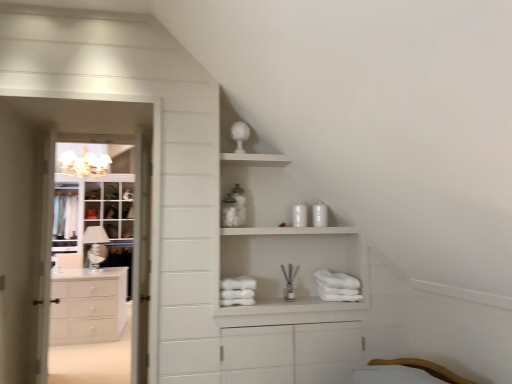
What do you see at coordinates (283, 242) in the screenshot? Image resolution: width=512 pixels, height=384 pixels. I see `white matte cabinet at upper center` at bounding box center [283, 242].

At what (x,y) coordinates should I click in order to perform the action: click on white wood door at left. Please return your answer as a coordinate pair (x, y). This screenshot has width=512, height=384. Looking at the image, I should click on (140, 258).

You are a GUI agent. You are given a task and a screenshot of the screen. Output one action in this format:
    pyautogui.click(x=<x>, y=<y>)
    Task: Click on the white glossy cabinet at left
    
    Given the screenshot: What is the action you would take?
    pyautogui.click(x=103, y=248)

What do you see at coordinates (103, 248) in the screenshot? I see `white glossy cabinet at left` at bounding box center [103, 248].

What do you see at coordinates (93, 211) in the screenshot? Image resolution: width=512 pixels, height=384 pixels. I see `white glass cabinet at left` at bounding box center [93, 211].

This screenshot has height=384, width=512. Describe the element at coordinates (88, 305) in the screenshot. I see `white matte chest of drawers at left` at that location.

Find the location of `white matte cabinet at upper center`. white matte cabinet at upper center is located at coordinates (283, 242).

From the image's perspective, is clear glass lamp at left located beneath white glossy cabinet at left?

Yes, from the image's perspective, clear glass lamp at left is beneath white glossy cabinet at left.

From the picture: Can white glossy cabinet at left be found inside clear glass lamp at left?

No, white glossy cabinet at left is located outside of clear glass lamp at left.

Is clear glass lamp at left closer to camera compared to white glossy cabinet at left?

No, clear glass lamp at left is further to the viewer.

Does clear glass lamp at left have a larger size compared to white glossy cabinet at left?

Actually, clear glass lamp at left might be smaller than white glossy cabinet at left.

Considering the positions of objects white glossy cabinet at left and white matte cabinet at upper center in the image provided, who is behind, white glossy cabinet at left or white matte cabinet at upper center?

Positioned behind is white glossy cabinet at left.

In the scene shown: Would you say white glossy cabinet at left contains white matte cabinet at upper center?

Actually, white matte cabinet at upper center is outside white glossy cabinet at left.

Is point (143, 255) closer or farther from the camera than point (231, 232)?

Point (143, 255) is closer to the camera than point (231, 232).

Consider the image. Between white glossy cabinet at left and white matte cabinet at upper center, which one appears on the right side from the viewer's perspective?

white matte cabinet at upper center.

Is white matte chest of drawers at left bigger or smaller than white matte cabinet at upper center?

Clearly, white matte chest of drawers at left is larger in size than white matte cabinet at upper center.

Is point (71, 285) closer or farther from the camera than point (273, 172)?

Point (71, 285).

Is white matte chest of drawers at left positioned beyond the bounds of white matte cabinet at upper center?

Indeed, white matte chest of drawers at left is completely outside white matte cabinet at upper center.

At what (x,y) coordinates should I click in order to perform the action: click on cupboard behind the white wood door at left. Please return your answer as a coordinate pair (x, y). This screenshot has height=384, width=512. Looking at the image, I should click on (93, 211).

Would you say white glass cabinet at left is outside white wood door at left?

Absolutely, white glass cabinet at left is external to white wood door at left.

Is white glass cabinet at left in contact with white wood door at left?

No, white glass cabinet at left is not in contact with white wood door at left.

From a real-world perspective, is white glass cabinet at left above or below white wood door at left?

In terms of real-world spatial position, white glass cabinet at left is above white wood door at left.

Is matte white chandelier at upper left at the left side of white matte cabinet at upper center?

Yes.

Between matte white chandelier at upper left and white matte cabinet at upper center, which one has smaller size?

matte white chandelier at upper left.

Between matte white chandelier at upper left and white matte cabinet at upper center, which one has smaller width?

white matte cabinet at upper center is thinner.

The width and height of the screenshot is (512, 384). What are the coordinates of `cabinet to the right of matte white chandelier at upper left` in the screenshot? It's located at (283, 242).

Would you consider white wood door at left to be distant from white matte chest of drawers at left?

That's right, there is a large distance between white wood door at left and white matte chest of drawers at left.

From the image's perspective, which one is positioned higher, white wood door at left or white matte chest of drawers at left?

white wood door at left appears higher in the image.

Which is in front, point (140, 272) or point (70, 294)?

The point (140, 272) is in front.

Considering the relative sizes of white matte chest of drawers at left and clear glass lamp at left in the image provided, is white matte chest of drawers at left bigger than clear glass lamp at left?

Indeed, white matte chest of drawers at left has a larger size compared to clear glass lamp at left.

From the image's perspective, which is below, white matte chest of drawers at left or clear glass lamp at left?

white matte chest of drawers at left, from the image's perspective.

Does white matte chest of drawers at left come in front of clear glass lamp at left?

Yes, the depth of white matte chest of drawers at left is less than that of clear glass lamp at left.

Where is `screen door on the right side of clear glass lamp at left`? The height and width of the screenshot is (384, 512). screen door on the right side of clear glass lamp at left is located at coordinates (x=103, y=248).

You are a GUI agent. You are given a task and a screenshot of the screen. Output one action in this format:
    pyautogui.click(x=<x>, y=<y>)
    Task: Click on the screen door that is under the white matte cabinet at upper center (from a real-world perspective)
    The height and width of the screenshot is (384, 512).
    Given the screenshot: What is the action you would take?
    pyautogui.click(x=103, y=248)

Based on their spatial positions, is white glossy cabinet at left or white matte cabinet at upper center closer to clear glass lamp at left?

white glossy cabinet at left.

Looking at the image, which one is located closer to white matte chest of drawers at left, white matte cabinet at upper center or matte white chandelier at upper left?

matte white chandelier at upper left lies closer to white matte chest of drawers at left than the other object.

Looking at the image, which one is located further to white glossy cabinet at left, white matte chest of drawers at left or white glass cabinet at left?

white matte chest of drawers at left is further to white glossy cabinet at left.

From the image, which object appears to be nearer to matte white chandelier at upper left, white glossy cabinet at left or clear glass lamp at left?

white glossy cabinet at left lies closer to matte white chandelier at upper left than the other object.

Looking at the image, which one is located further to clear glass lamp at left, matte white chandelier at upper left or white glossy cabinet at left?

Based on the image, matte white chandelier at upper left appears to be further to clear glass lamp at left.

Looking at the image, which one is located further to white glass cabinet at left, white matte chest of drawers at left or white wood door at left?

Among the two, white wood door at left is located further to white glass cabinet at left.

From the image, which object appears to be farther from white wood door at left, white glass cabinet at left or matte white chandelier at upper left?

matte white chandelier at upper left is further to white wood door at left.

Considering their positions, is white matte chest of drawers at left positioned further to white matte cabinet at upper center than white wood door at left?

white matte chest of drawers at left.

At what (x,y) coordinates should I click in order to perform the action: click on screen door positioned between white matte cabinet at upper center and matte white chandelier at upper left from near to far. Please return your answer as a coordinate pair (x, y). Looking at the image, I should click on (103, 248).

Identify the location of lamp positioned between white matte cabinet at upper center and white glass cabinet at left from near to far. (95, 246).

Where is `lamp between matte white chandelier at upper left and white matte chest of drawers at left vertically`? The image size is (512, 384). lamp between matte white chandelier at upper left and white matte chest of drawers at left vertically is located at coordinates (95, 246).

At what (x,y) coordinates should I click in order to perform the action: click on light fixture between white glossy cabinet at left and white glass cabinet at left from front to back. Please return your answer as a coordinate pair (x, y). The image size is (512, 384). Looking at the image, I should click on (84, 164).